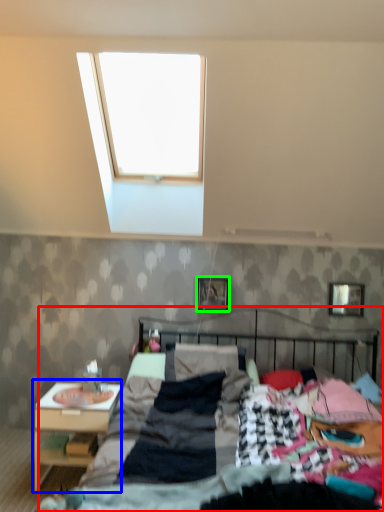
Question: Based on their relative distances, which object is farther from bed (highlighted by a red box)? Choose from nightstand (highlighted by a blue box) and picture frame (highlighted by a green box).

Choices:
 (A) nightstand
 (B) picture frame

Answer: (B)